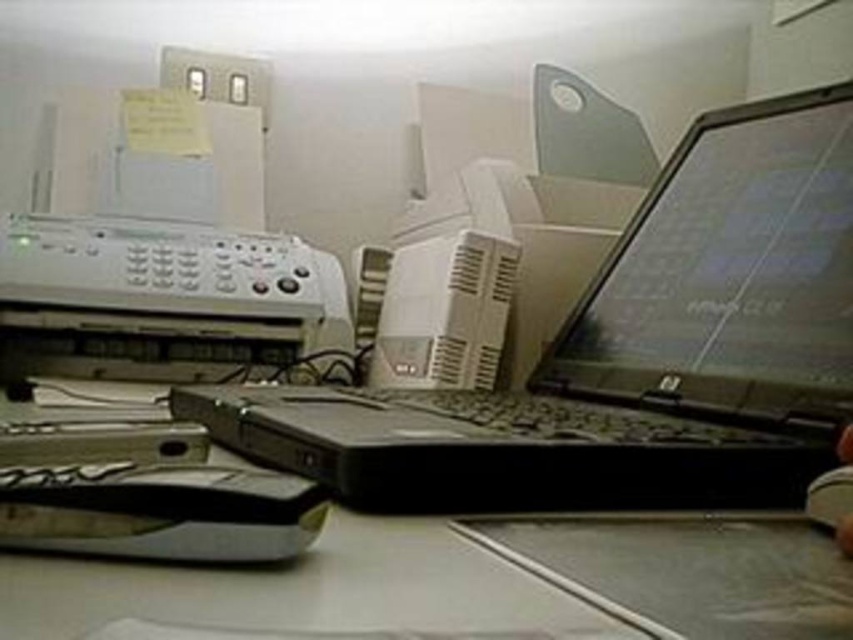
Question: Can you confirm if white plastic printer at upper left is positioned to the left of black plastic mouse at lower right?

Choices:
 (A) no
 (B) yes

Answer: (B)

Question: Among these points, which one is nearest to the camera?

Choices:
 (A) (219, 317)
 (B) (437, 376)

Answer: (B)

Question: Is black plastic laptop at center further to camera compared to white plastic printer at upper left?

Choices:
 (A) no
 (B) yes

Answer: (A)

Question: Which object appears closest to the camera in this image?

Choices:
 (A) white plastic printer at upper left
 (B) black plastic mouse at lower right
 (C) black plastic laptop at center
 (D) black plastic computer desk at center

Answer: (D)

Question: Where is white plastic printer at upper left located in relation to black plastic mouse at lower right in the image?

Choices:
 (A) above
 (B) below

Answer: (A)

Question: Among these points, which one is farthest from the camera?

Choices:
 (A) pos(144,372)
 (B) pos(419,284)
 (C) pos(567,600)
 (D) pos(808,484)

Answer: (A)